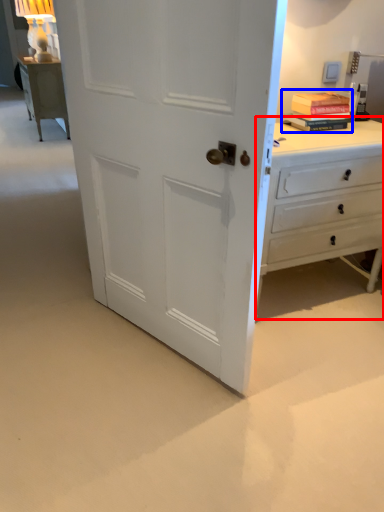
Question: Among these objects, which one is farthest to the camera, chest of drawers (highlighted by a red box) or book (highlighted by a blue box)?

Choices:
 (A) chest of drawers
 (B) book

Answer: (B)